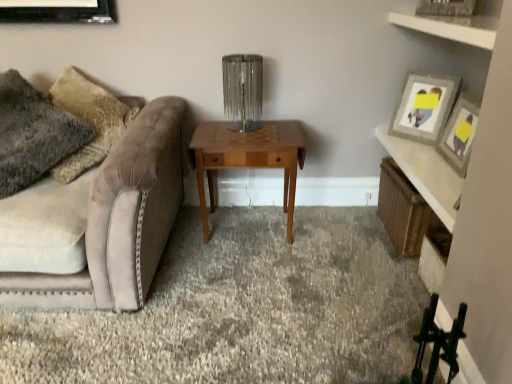
You are a GUI agent. You are given a task and a screenshot of the screen. Output one action in this format:
    pyautogui.click(x=<x>, y=<y>)
    Task: Click on the free spot to the right of clear glass table lamp at center
    This screenshot has width=512, height=384.
    Given the screenshot: What is the action you would take?
    pyautogui.click(x=276, y=129)